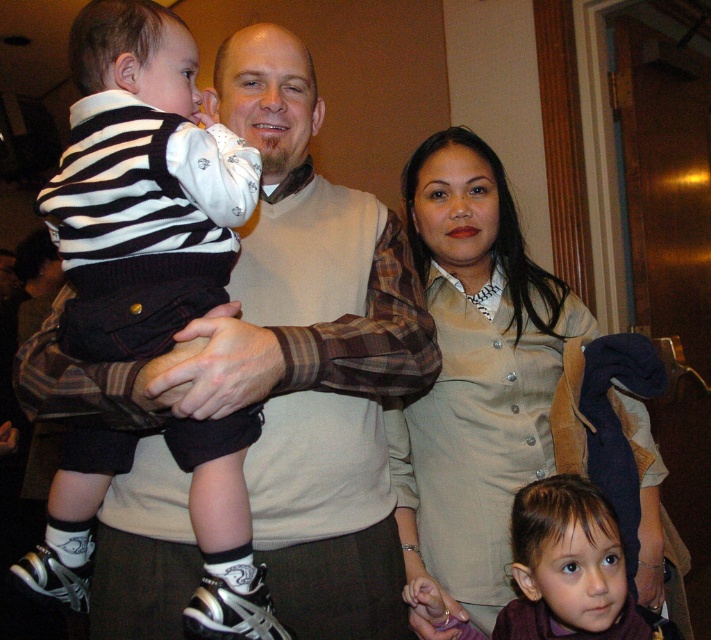
What do you see at coordinates (475, 372) in the screenshot? This screenshot has width=711, height=640. I see `matte beige dress at center` at bounding box center [475, 372].

This screenshot has height=640, width=711. What do you see at coordinates (475, 372) in the screenshot? I see `matte beige dress at center` at bounding box center [475, 372].

Find the location of a particular element. The height and width of the screenshot is (640, 711). matte beige dress at center is located at coordinates (475, 372).

Who is higher up, striped knit sweater at center or brown matte hair at lower right?

striped knit sweater at center

Does striped knit sweater at center appear on the right side of brown matte hair at lower right?

No, striped knit sweater at center is not to the right of brown matte hair at lower right.

In order to click on striped knit sweater at center in this screenshot , I will do `click(144, 186)`.

Where is `striped knit sweater at center`? striped knit sweater at center is located at coordinates (144, 186).

Does striped knit sweater at center appear on the left side of matte beige dress at center?

Indeed, striped knit sweater at center is positioned on the left side of matte beige dress at center.

Which is in front, point (187, 429) or point (476, 548)?

Point (187, 429)

Identify the location of striped knit sweater at center. Image resolution: width=711 pixels, height=640 pixels. (144, 186).